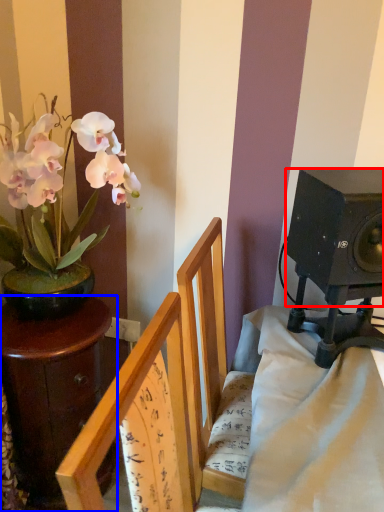
Question: Which object appears farthest to the camera in this image, loudspeaker (highlighted by a red box) or table (highlighted by a blue box)?

Choices:
 (A) loudspeaker
 (B) table

Answer: (B)